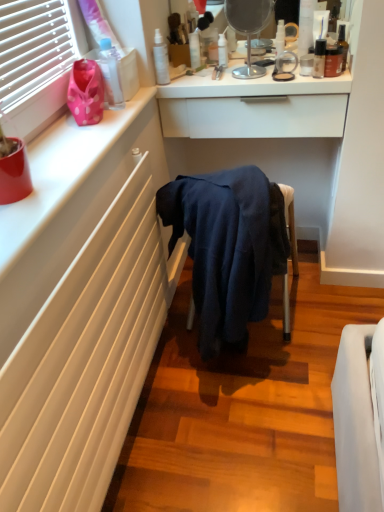
Find the location of `vacant space that is in between satin white spray bottle at upper center, the 2th toiletry from the left, and shiny brown bottle at upper right, the first toiletry positioned from the right`. vacant space that is in between satin white spray bottle at upper center, the 2th toiletry from the left, and shiny brown bottle at upper right, the first toiletry positioned from the right is located at coordinates (222, 79).